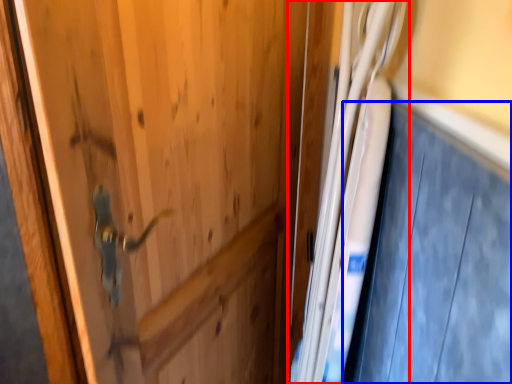
Question: Among these objects, which one is farthest to the camera, fridge (highlighted by a red box) or car door (highlighted by a blue box)?

Choices:
 (A) fridge
 (B) car door

Answer: (A)